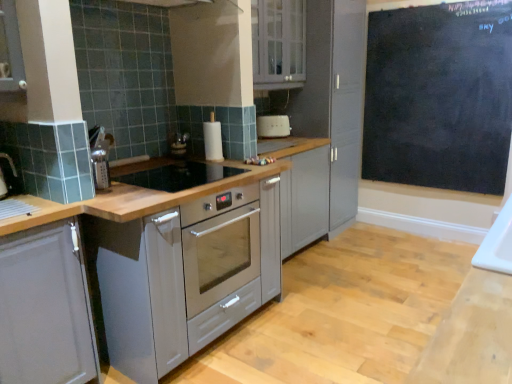
Image resolution: width=512 pixels, height=384 pixels. What are the coordinates of `vacant space situated above black chalkboard at upper right (from a real-world perspective)` in the screenshot? It's located at (422, 4).